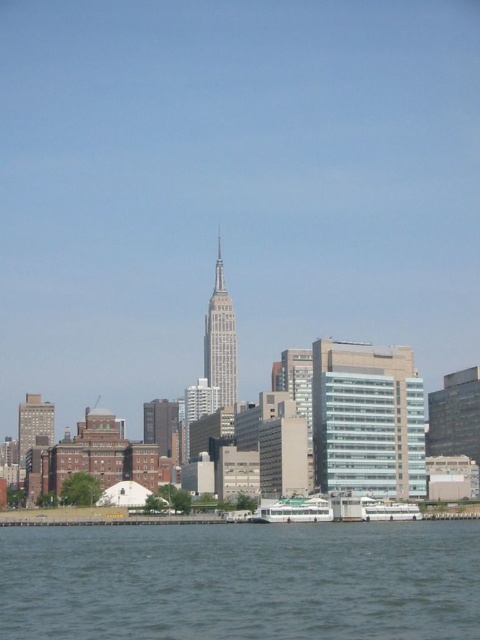
Question: Which is farther from the gray glass tower at center?

Choices:
 (A) white glossy boat at lower center
 (B) white glossy boat at lower right

Answer: (B)

Question: Does white glossy boat at lower center appear on the right side of white glossy boat at lower right?

Choices:
 (A) yes
 (B) no

Answer: (B)

Question: Which point is closer to the camera?

Choices:
 (A) white glossy boat at lower right
 (B) gray glass tower at center

Answer: (A)

Question: Which point appears closest to the camera in this image?

Choices:
 (A) (465, 625)
 (B) (303, 497)
 (C) (373, 506)
 (D) (215, 324)

Answer: (A)

Question: Does clear water at lower left have a greater width compared to white glossy boat at lower right?

Choices:
 (A) no
 (B) yes

Answer: (B)

Question: Is brick textured building at left to the right of white glossy boat at lower center from the viewer's perspective?

Choices:
 (A) yes
 (B) no

Answer: (B)